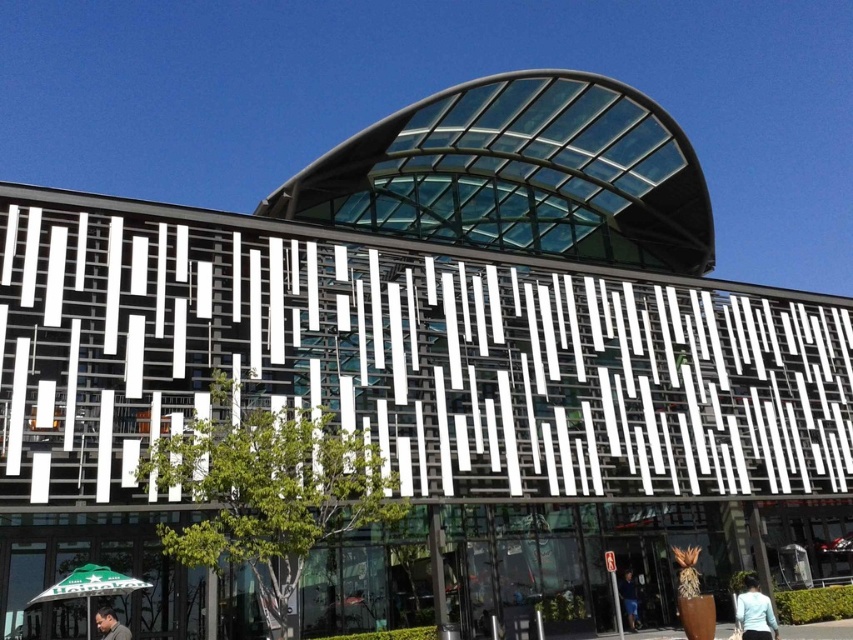
Is point (749, 621) positioned before point (106, 637)?

No, (749, 621) is behind (106, 637).

Is the position of light blue fabric at lower right more distant than that of dark brown leather jacket at lower left?

That is True.

Does point (770, 611) come closer to viewer compared to point (106, 627)?

No.

Locate an element on the screen. The width and height of the screenshot is (853, 640). light blue fabric at lower right is located at coordinates (753, 612).

Is green fabric umbrella at lower left closer to the viewer compared to light blue fabric at lower right?

No, it is not.

Looking at this image, measure the distance between green fabric umbrella at lower left and light blue fabric at lower right.

green fabric umbrella at lower left is 14.87 meters away from light blue fabric at lower right.

You are a GUI agent. You are given a task and a screenshot of the screen. Output one action in this format:
    pyautogui.click(x=<x>, y=<y>)
    Task: Click on the green fabric umbrella at lower left
    Image resolution: width=853 pixels, height=640 pixels.
    Given the screenshot: What is the action you would take?
    pyautogui.click(x=90, y=586)

Locate an element on the screen. green fabric umbrella at lower left is located at coordinates (90, 586).

Between light blue fabric at lower right and dark blue jeans at lower center, which one appears on the left side from the viewer's perspective?

From the viewer's perspective, dark blue jeans at lower center appears more on the left side.

Which of these two, light blue fabric at lower right or dark blue jeans at lower center, stands taller?

light blue fabric at lower right

The image size is (853, 640). What do you see at coordinates (753, 612) in the screenshot?
I see `light blue fabric at lower right` at bounding box center [753, 612].

What are the coordinates of `light blue fabric at lower right` in the screenshot? It's located at (753, 612).